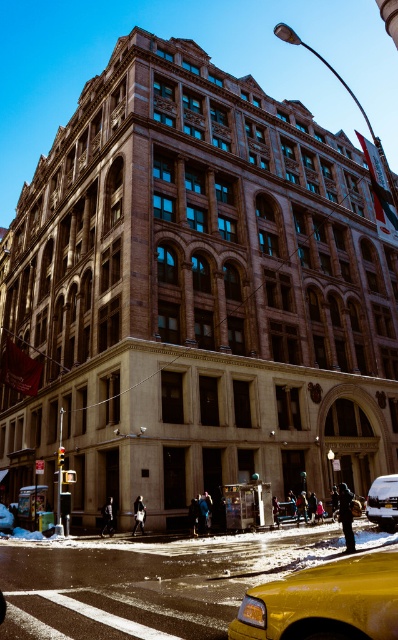
You are a delivery driver who needs to park your vehicle in the parking lot near the large historic building. The parking lot has a designated parking spot at point 0.911, 0.369. Can you safely park your vehicle there if the parking spot is exactly where the yellow plastic taxi at center is currently located?

The yellow plastic taxi at center is currently parked at the designated parking spot at point (146, 582). Therefore, you cannot park there as the spot is already occupied by the yellow plastic taxi at center.

You are a delivery person needing to park your yellow matte taxi at lower right near the historic building. According to the image, where exactly should you position your taxi relative to the building?

The yellow matte taxi at lower right should be positioned at point (x=325, y=602) relative to the building.

You are a delivery person who needs to park your silver metallic van at center in a parking spot that is only 1.5 meters tall. There is a yellow plastic taxi at center in front of it. Can your van fit into the parking spot without hitting the roof?

The yellow plastic taxi at center is much taller than the silver metallic van at center, so the van should fit into the parking spot since it is shorter than the taxi and the parking spot is 1.5 meters tall.